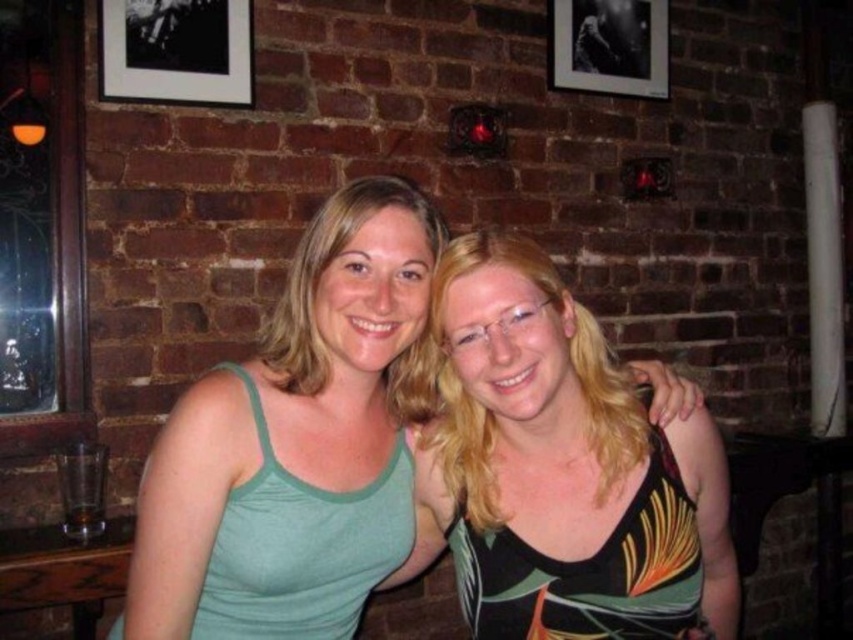
Where is `green fabric tank top at center`? The width and height of the screenshot is (853, 640). green fabric tank top at center is located at coordinates (x=297, y=445).

Is green fabric tank top at center behind black matte picture frame at upper right?

No, it is not.

Between point (374, 538) and point (581, 38), which one is positioned behind?

Positioned behind is point (581, 38).

The width and height of the screenshot is (853, 640). Find the location of `green fabric tank top at center`. green fabric tank top at center is located at coordinates (297, 445).

Consider the image. Does green fabric tank top at center appear on the left side of black matte picture frame at upper left?

In fact, green fabric tank top at center is to the right of black matte picture frame at upper left.

Does green fabric tank top at center have a lesser width compared to black matte picture frame at upper left?

No, green fabric tank top at center is not thinner than black matte picture frame at upper left.

Who is more distant from viewer, (180,593) or (178,88)?

Point (178,88)

Identify the location of green fabric tank top at center. This screenshot has width=853, height=640. click(x=297, y=445).

Is green fabric tank top at center further to the viewer compared to green textured tank top at center?

Yes, green fabric tank top at center is behind green textured tank top at center.

Is point (410, 314) closer to camera compared to point (534, 557)?

No, it is not.

Where is `green fabric tank top at center`? This screenshot has width=853, height=640. green fabric tank top at center is located at coordinates (297, 445).